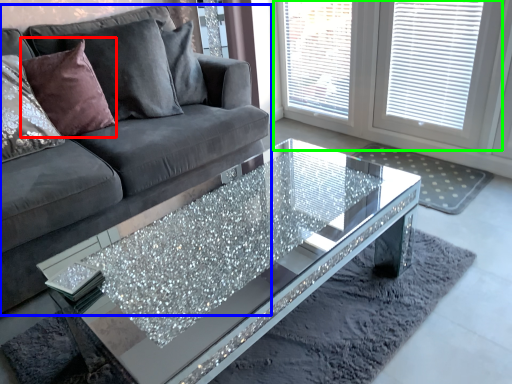
Question: Considering the real-world distances, which object is closest to pillow (highlighted by a red box)? studio couch (highlighted by a blue box) or window (highlighted by a green box).

Choices:
 (A) studio couch
 (B) window

Answer: (A)